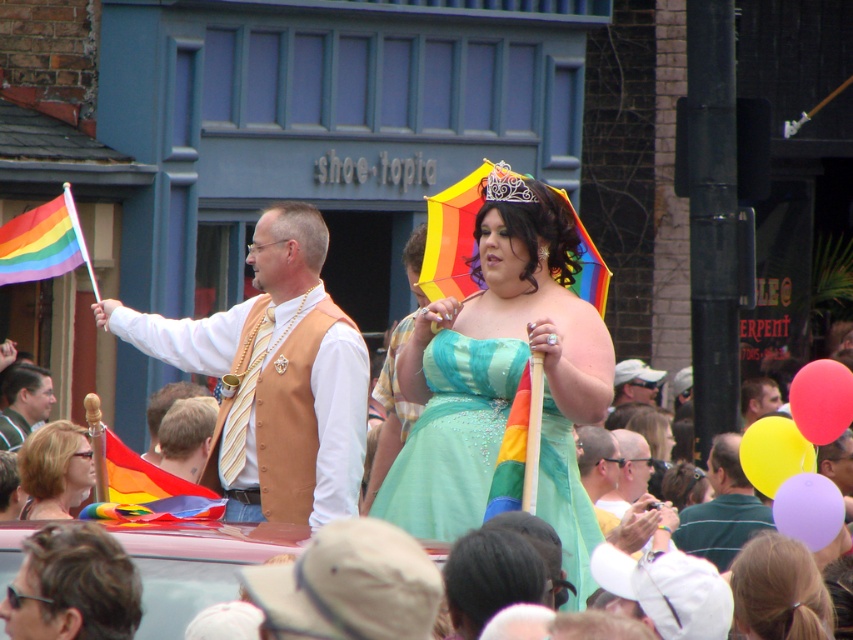
Measure the distance between rainbow fabric flag at left and yellow plaid shirt at center.

They are 4.79 meters apart.

Between rainbow fabric flag at left and yellow plaid shirt at center, which one is positioned lower?

Positioned lower is yellow plaid shirt at center.

Who is more distant from viewer, [67,243] or [395,435]?

Positioned behind is point [395,435].

Locate an element on the screen. The width and height of the screenshot is (853, 640). rainbow fabric flag at left is located at coordinates (44, 243).

Is green jersey at center shorter than smooth brown hair at center?

Correct, green jersey at center is not as tall as smooth brown hair at center.

Is green jersey at center thinner than smooth brown hair at center?

Incorrect, green jersey at center's width is not less than smooth brown hair at center's.

Which is in front, point (712, 472) or point (747, 385)?

Point (712, 472)

You are a GUI agent. You are given a task and a screenshot of the screen. Output one action in this format:
    pyautogui.click(x=<x>, y=<y>)
    Task: Click on the green jersey at center
    The width and height of the screenshot is (853, 640).
    Given the screenshot: What is the action you would take?
    pyautogui.click(x=722, y=508)

Which is above, dark brown hair at lower left or rainbow fabric flag at left?

rainbow fabric flag at left is higher up.

Measure the distance between dark brown hair at lower left and rainbow fabric flag at left.

They are 10.74 meters apart.

Is point (57, 620) closer to viewer compared to point (80, 244)?

Yes, point (57, 620) is closer to viewer.

Locate an element on the screen. dark brown hair at lower left is located at coordinates (73, 586).